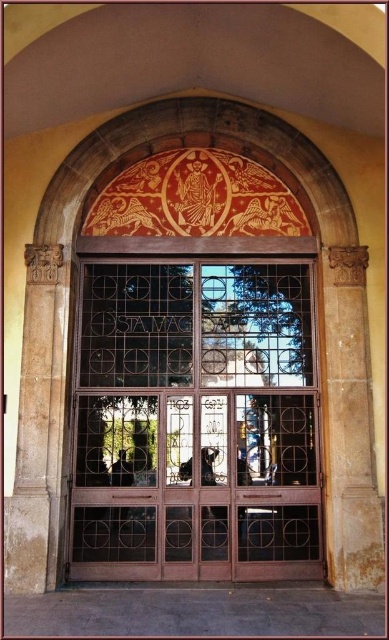
You are an interior designer assessing the entranceway. You need to determine the spatial relationship between the gold textured tapestry at upper center and the rustic stone pillar at left. Which object is closer to the viewer?

The gold textured tapestry at upper center is closer to the viewer than the rustic stone pillar at left, which is positioned behind it.